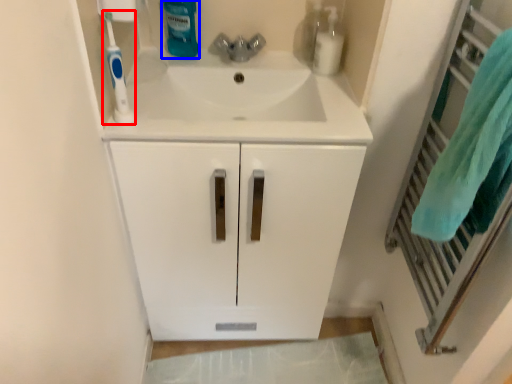
Question: Among these objects, which one is farthest to the camera, toothbrush (highlighted by a red box) or cleaning product (highlighted by a blue box)?

Choices:
 (A) toothbrush
 (B) cleaning product

Answer: (B)